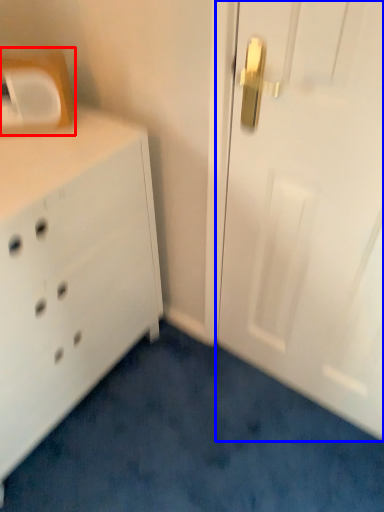
Question: Which of the following is the farthest to the observer, medicine cabinet (highlighted by a red box) or door (highlighted by a blue box)?

Choices:
 (A) medicine cabinet
 (B) door

Answer: (A)